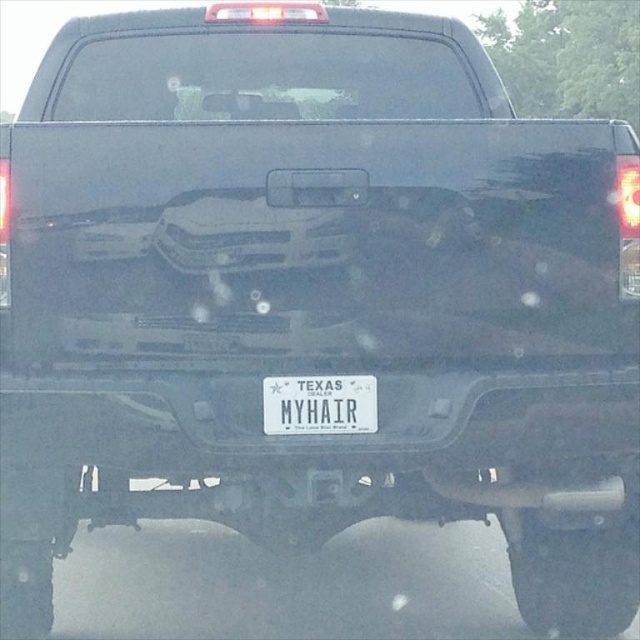
Question: Is white plastic bumper at center below white plastic license plate at center?

Choices:
 (A) no
 (B) yes

Answer: (B)

Question: Observing the image, what is the correct spatial positioning of white plastic bumper at center in reference to white plastic license plate at center?

Choices:
 (A) above
 (B) below

Answer: (B)

Question: Which of the following is the closest to the observer?

Choices:
 (A) (308, 465)
 (B) (356, 408)

Answer: (B)

Question: Which object appears closest to the camera in this image?

Choices:
 (A) white plastic bumper at center
 (B) white plastic license plate at center

Answer: (A)

Question: Is white plastic bumper at center above white plastic license plate at center?

Choices:
 (A) yes
 (B) no

Answer: (B)